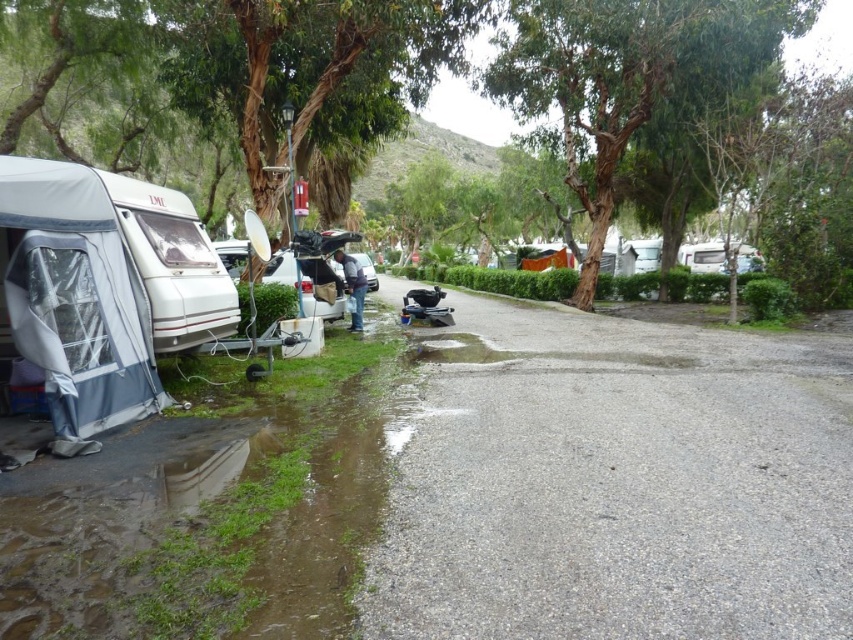
Question: Which object is farther from the camera taking this photo?

Choices:
 (A) metallic silver car at center
 (B) white fabric tent at left

Answer: (A)

Question: Can you confirm if white fabric tent at left is positioned to the left of green rough bark tree at upper center?

Choices:
 (A) yes
 (B) no

Answer: (A)

Question: Does white fabric tent at left lie in front of metallic silver car at center?

Choices:
 (A) no
 (B) yes

Answer: (B)

Question: Which point is closer to the camera?

Choices:
 (A) (614, 84)
 (B) (128, 316)
 (C) (352, 257)

Answer: (B)

Question: Can you confirm if white fabric tent at left is thinner than metallic silver car at center?

Choices:
 (A) yes
 (B) no

Answer: (A)

Question: Which point is closer to the camera?

Choices:
 (A) green rough bark tree at upper center
 (B) white fabric tent at left

Answer: (B)